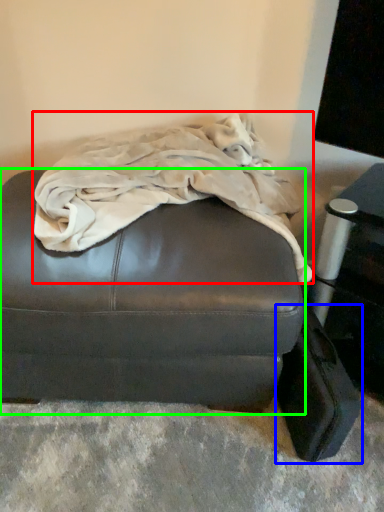
Question: Estimate the real-world distances between objects in this image. Which object is closer to blanket (highlighted by a red box), luggage (highlighted by a blue box) or furniture (highlighted by a green box)?

Choices:
 (A) luggage
 (B) furniture

Answer: (B)